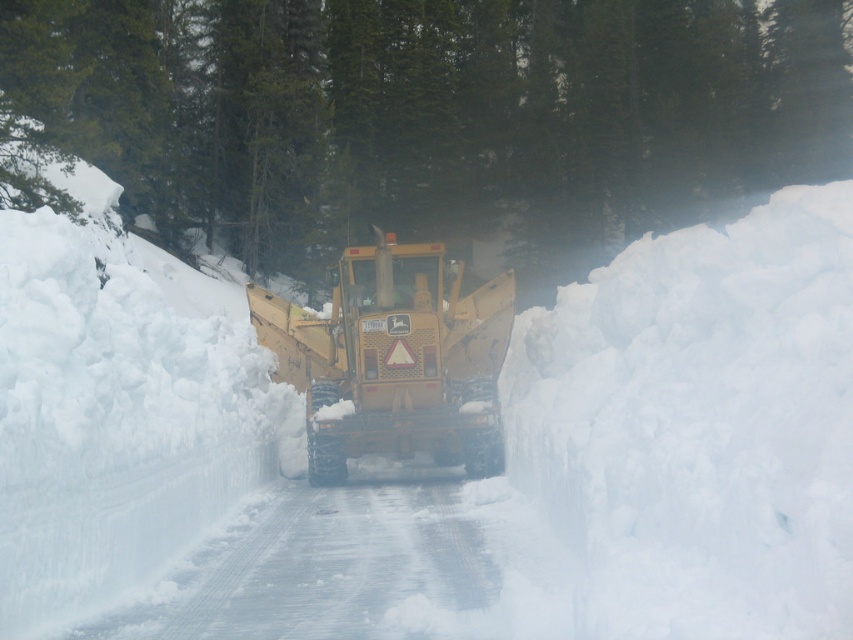
You are a driver approaching the road with the green matte tree at upper center and the metallic yellow snowplow at center. Which object is bigger?

The green matte tree at upper center is larger in size compared to the metallic yellow snowplow at center.

From the picture: You are standing at the camera position and want to take a photo of the green matte tree at upper center. The camera has a maximum zoom range of 20 meters. Can you capture the entire tree in the photo without moving closer?

The green matte tree at upper center is 23.51 meters away from the camera, which exceeds the camera maximum zoom range of 20 meters. Therefore, you cannot capture the entire tree in the photo without moving closer.